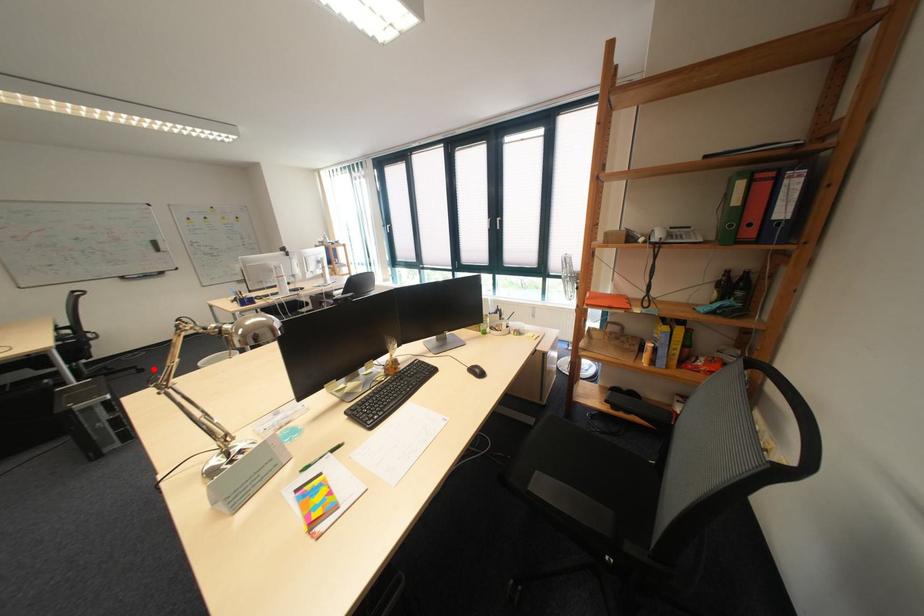
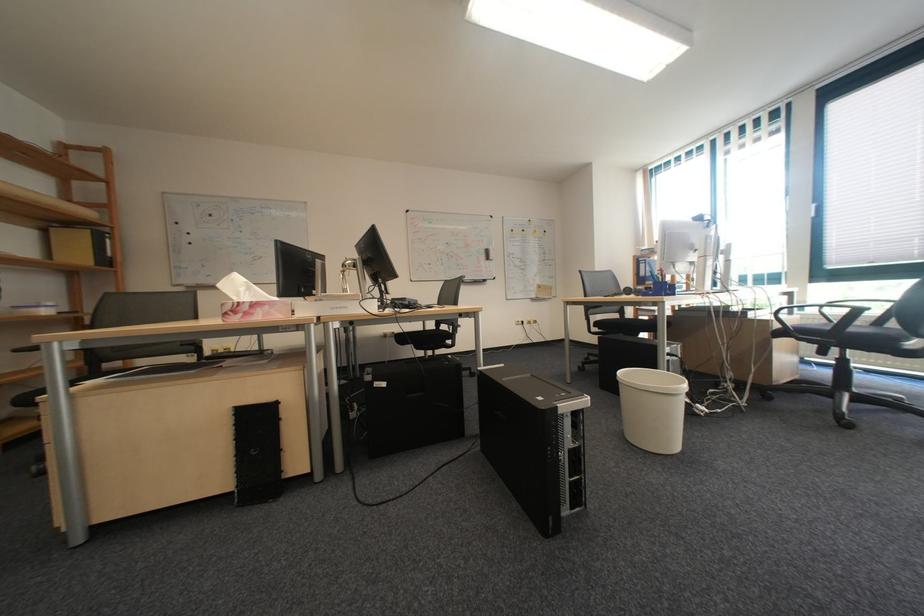
Locate, in the second image, the point that corresponds to the highlighted location in the first image.

(487, 371)